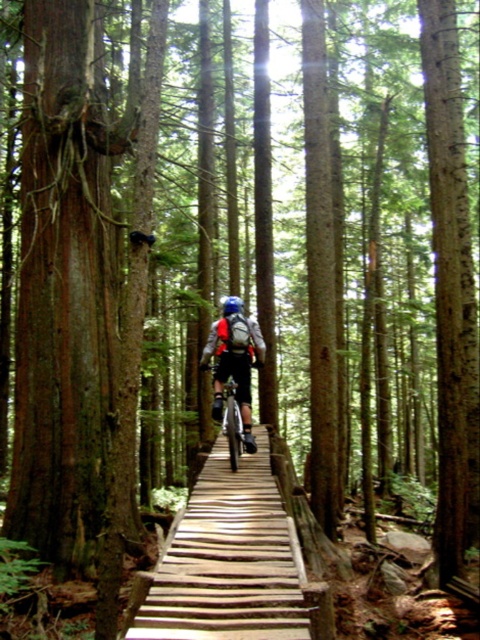
Question: Is wooden planks bridge at center positioned at the back of silver metallic mountain bike at center?

Choices:
 (A) yes
 (B) no

Answer: (B)

Question: Among these objects, which one is nearest to the camera?

Choices:
 (A) silver metallic mountain bike at center
 (B) wooden planks bridge at center
 (C) blue matte helmet at center

Answer: (B)

Question: Which point is closer to the camera taking this photo?

Choices:
 (A) (257, 593)
 (B) (229, 308)
 (C) (237, 428)

Answer: (A)

Question: Does wooden planks bridge at center appear under silver metallic mountain bike at center?

Choices:
 (A) yes
 (B) no

Answer: (A)

Question: Is wooden planks bridge at center smaller than blue matte helmet at center?

Choices:
 (A) yes
 (B) no

Answer: (A)

Question: Based on their relative distances, which object is nearer to the silver metallic mountain bike at center?

Choices:
 (A) wooden planks bridge at center
 (B) blue matte helmet at center

Answer: (A)